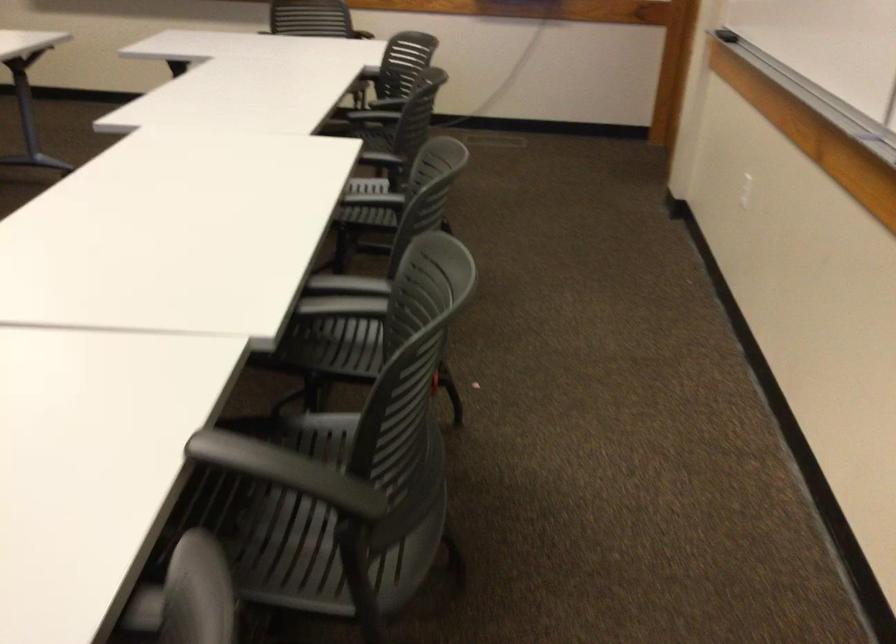
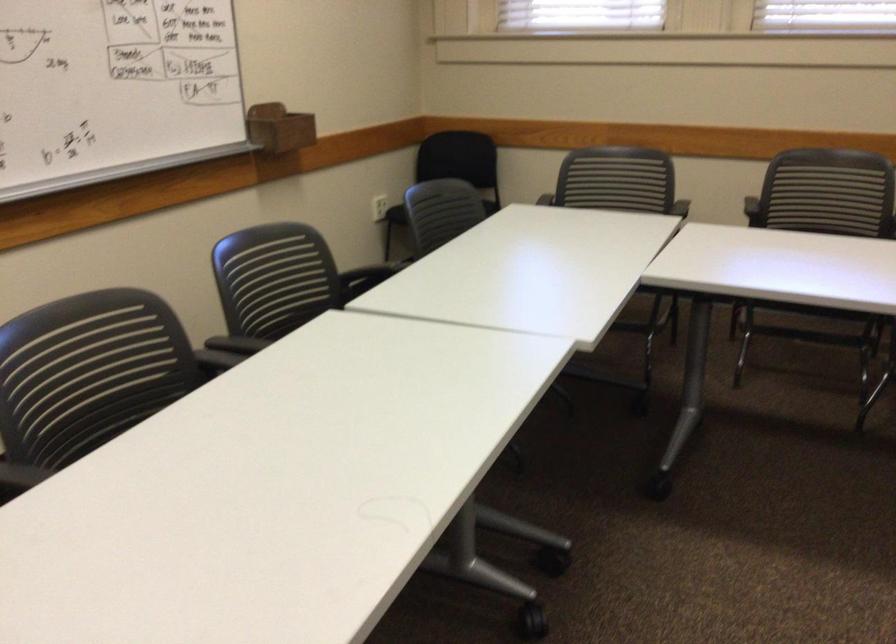
Where in the second image is the point corresponding to [402,252] from the first image?

(125, 375)